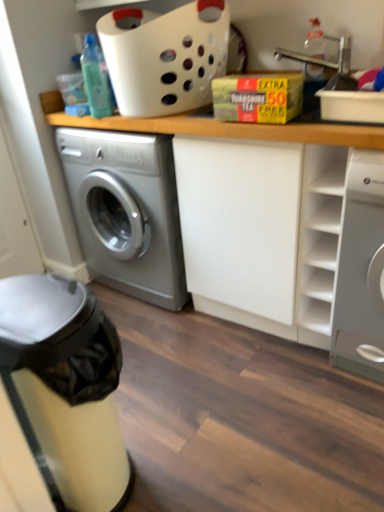
Question: Is clear plastic bottle at upper right, positioned as the 1th bottle in right-to-left order, smaller than white glossy washing machine at right?

Choices:
 (A) yes
 (B) no

Answer: (A)

Question: Is clear plastic bottle at upper right, the second bottle positioned from the left, wider than white glossy washing machine at right?

Choices:
 (A) no
 (B) yes

Answer: (A)

Question: Are clear plastic bottle at upper right, the second bottle positioned from the left, and white glossy washing machine at right making contact?

Choices:
 (A) yes
 (B) no

Answer: (B)

Question: Considering the relative positions of clear plastic bottle at upper right, positioned as the 1th bottle in right-to-left order, and white glossy washing machine at right in the image provided, is clear plastic bottle at upper right, positioned as the 1th bottle in right-to-left order, to the left of white glossy washing machine at right from the viewer's perspective?

Choices:
 (A) yes
 (B) no

Answer: (A)

Question: Does clear plastic bottle at upper right, the second bottle positioned from the left, have a greater height compared to white glossy washing machine at right?

Choices:
 (A) no
 (B) yes

Answer: (A)

Question: Considering the relative positions of clear plastic bottle at upper right, the second bottle positioned from the left, and translucent plastic bottle at upper left, placed as the second bottle when sorted from right to left, in the image provided, is clear plastic bottle at upper right, the second bottle positioned from the left, to the left or to the right of translucent plastic bottle at upper left, placed as the second bottle when sorted from right to left,?

Choices:
 (A) right
 (B) left

Answer: (A)

Question: From a real-world perspective, relative to translucent plastic bottle at upper left, the first bottle positioned from the left, is clear plastic bottle at upper right, positioned as the 1th bottle in right-to-left order, vertically above or below?

Choices:
 (A) above
 (B) below

Answer: (B)

Question: Is point (319, 50) positioned closer to the camera than point (107, 105)?

Choices:
 (A) farther
 (B) closer

Answer: (A)

Question: From the image's perspective, is clear plastic bottle at upper right, the second bottle positioned from the left, above or below translucent plastic bottle at upper left, the first bottle positioned from the left?

Choices:
 (A) above
 (B) below

Answer: (A)

Question: Looking at the image, does wooden counter at center seem bigger or smaller compared to matte silver dishwasher at lower left?

Choices:
 (A) big
 (B) small

Answer: (A)

Question: In the image, is wooden counter at center positioned in front of or behind matte silver dishwasher at lower left?

Choices:
 (A) behind
 (B) front

Answer: (A)

Question: Is point (198, 130) closer or farther from the camera than point (31, 352)?

Choices:
 (A) farther
 (B) closer

Answer: (A)

Question: Would you say wooden counter at center is to the left or to the right of matte silver dishwasher at lower left in the picture?

Choices:
 (A) left
 (B) right

Answer: (B)

Question: Considering their positions, is white plastic basket at upper center located in front of or behind matte silver dishwasher at lower left?

Choices:
 (A) front
 (B) behind

Answer: (B)

Question: Is white plastic basket at upper center wider or thinner than matte silver dishwasher at lower left?

Choices:
 (A) wide
 (B) thin

Answer: (A)